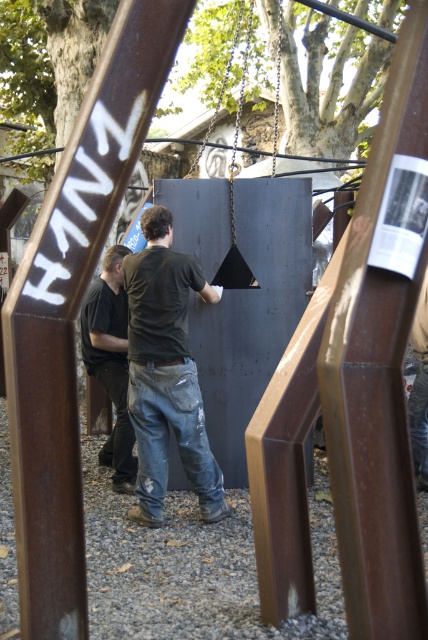
Question: From the image, what is the correct spatial relationship of brushed metal sign at upper left in relation to black cotton shirt at center?

Choices:
 (A) below
 (B) above

Answer: (B)

Question: Which object appears farthest from the camera in this image?

Choices:
 (A) black matte shirt at center
 (B) black cotton shirt at center
 (C) brushed metal sign at upper left

Answer: (B)

Question: Is black matte shirt at center above black cotton shirt at center?

Choices:
 (A) no
 (B) yes

Answer: (B)

Question: Which object is positioned farthest from the brushed metal sign at upper left?

Choices:
 (A) black cotton shirt at center
 (B) black matte shirt at center

Answer: (A)

Question: Among these points, which one is farthest from the camera?

Choices:
 (A) tap(92, 314)
 (B) tap(183, 273)

Answer: (A)

Question: Can you confirm if brushed metal sign at upper left is thinner than black cotton shirt at center?

Choices:
 (A) no
 (B) yes

Answer: (B)